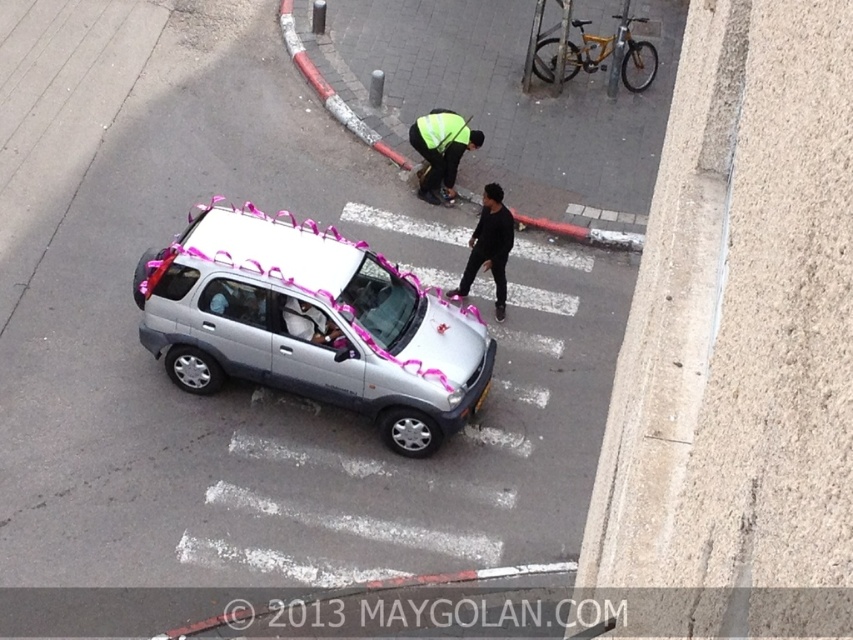
Question: Does red rubber curb at center have a greater width compared to reflective yellow safety vest at center?

Choices:
 (A) yes
 (B) no

Answer: (B)

Question: Is reflective yellow vest at center behind black matte clothing at center?

Choices:
 (A) no
 (B) yes

Answer: (B)

Question: Which point appears farthest from the camera in this image?

Choices:
 (A) (277, 352)
 (B) (608, 237)

Answer: (B)

Question: Which point is closer to the camera taking this photo?

Choices:
 (A) (500, 244)
 (B) (366, 140)
 (C) (437, 134)

Answer: (A)

Question: From the image, what is the correct spatial relationship of silver metallic car at center in relation to black matte clothing at center?

Choices:
 (A) right
 (B) left

Answer: (B)

Question: Which object is positioned closest to the red rubber curb at center?

Choices:
 (A) silver metallic car at center
 (B) reflective yellow vest at center
 (C) black matte clothing at center
 (D) yellow matte bicycle at upper right

Answer: (B)